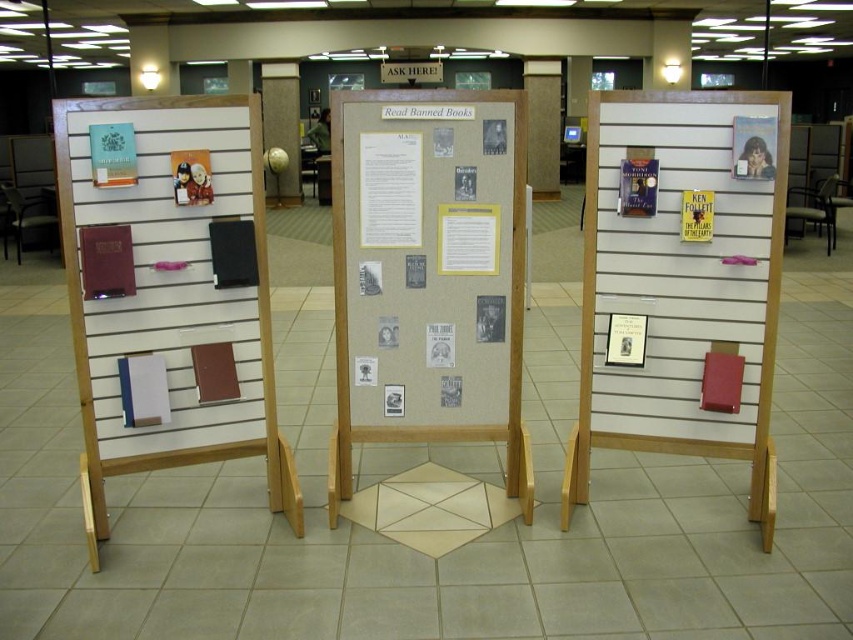
Question: Does matte wood globe at center have a larger size compared to matte paper poster at center?

Choices:
 (A) yes
 (B) no

Answer: (A)

Question: Does matte plastic poster at upper right appear under black plastic chair at center?

Choices:
 (A) no
 (B) yes

Answer: (B)

Question: Which point is closer to the camera?

Choices:
 (A) matte plastic poster at center
 (B) matte plastic poster at upper right
 (C) beige fabric poster at center
 (D) matte black chair at left

Answer: (B)

Question: Is matte blue book at center below yellow paper poster at center?

Choices:
 (A) yes
 (B) no

Answer: (B)

Question: Which object is the farthest from the yellow paper poster at center?

Choices:
 (A) matte wood globe at center
 (B) yellow paper at center
 (C) matte black chair at left

Answer: (A)

Question: Which point is closer to the camera taking this photo?

Choices:
 (A) (630, 321)
 (B) (828, 214)

Answer: (A)